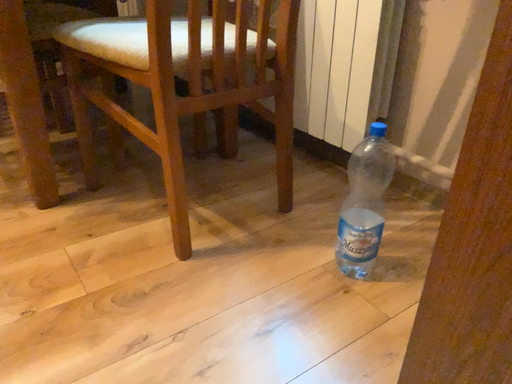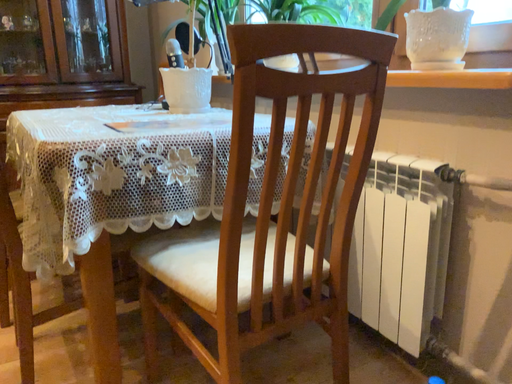
Question: Which way did the camera rotate in the video?

Choices:
 (A) rotated left
 (B) rotated right

Answer: (A)